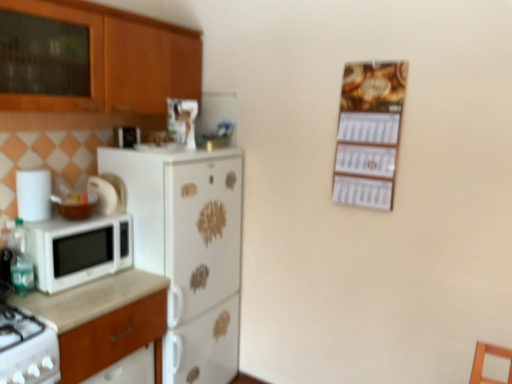
Question: Could you tell me if wooden cabinet at upper left is facing white laminate countertop at left?

Choices:
 (A) yes
 (B) no

Answer: (B)

Question: From the image's perspective, is wooden cabinet at upper left beneath white laminate countertop at left?

Choices:
 (A) yes
 (B) no

Answer: (B)

Question: Is wooden cabinet at upper left bigger than white laminate countertop at left?

Choices:
 (A) yes
 (B) no

Answer: (A)

Question: Is wooden cabinet at upper left positioned in front of white laminate countertop at left?

Choices:
 (A) no
 (B) yes

Answer: (B)

Question: Is wooden cabinet at upper left far from white laminate countertop at left?

Choices:
 (A) yes
 (B) no

Answer: (B)

Question: Does wooden cabinet at upper left appear on the right side of white laminate countertop at left?

Choices:
 (A) no
 (B) yes

Answer: (B)

Question: From the image's perspective, is wooden calendar at upper right under translucent plastic bottle at left?

Choices:
 (A) no
 (B) yes

Answer: (A)

Question: Is wooden calendar at upper right aimed at translucent plastic bottle at left?

Choices:
 (A) no
 (B) yes

Answer: (A)

Question: Can you confirm if wooden calendar at upper right is shorter than translucent plastic bottle at left?

Choices:
 (A) no
 (B) yes

Answer: (A)

Question: From a real-world perspective, is wooden calendar at upper right on translucent plastic bottle at left?

Choices:
 (A) no
 (B) yes

Answer: (B)

Question: Considering the relative sizes of wooden calendar at upper right and translucent plastic bottle at left in the image provided, is wooden calendar at upper right wider than translucent plastic bottle at left?

Choices:
 (A) no
 (B) yes

Answer: (A)

Question: Considering the relative positions of wooden calendar at upper right and translucent plastic bottle at left in the image provided, is wooden calendar at upper right to the left of translucent plastic bottle at left from the viewer's perspective?

Choices:
 (A) no
 (B) yes

Answer: (A)

Question: Could you tell me if wooden cabinet at upper left is facing wooden calendar at upper right?

Choices:
 (A) no
 (B) yes

Answer: (B)